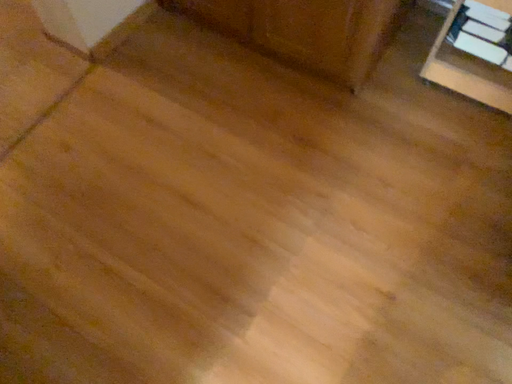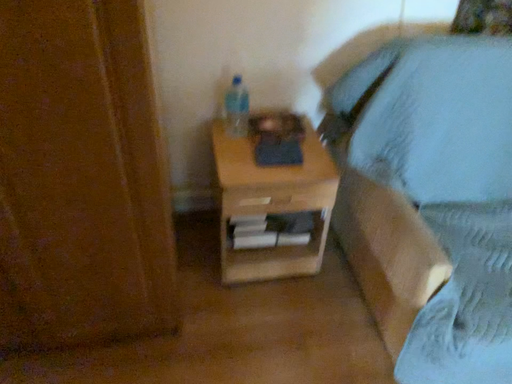
Question: Which way did the camera rotate in the video?

Choices:
 (A) rotated left
 (B) rotated right

Answer: (B)